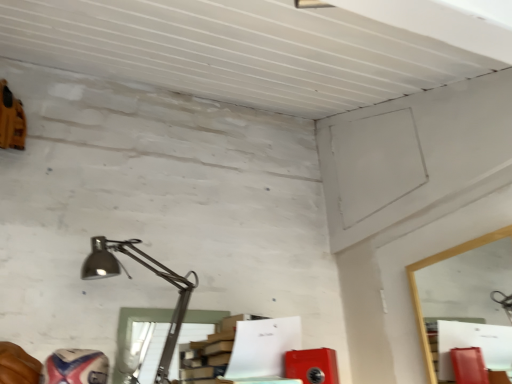
What is the approximate width of satin silver lamp at lower left?

7.33 inches.

Locate an element on the screen. Image resolution: width=512 pixels, height=384 pixels. satin silver lamp at lower left is located at coordinates (130, 278).

Image resolution: width=512 pixels, height=384 pixels. What do you see at coordinates (130, 278) in the screenshot? I see `satin silver lamp at lower left` at bounding box center [130, 278].

The height and width of the screenshot is (384, 512). In order to click on satin silver lamp at lower left in this screenshot , I will do `click(130, 278)`.